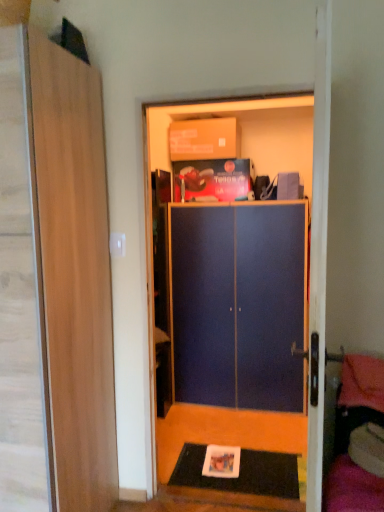
The width and height of the screenshot is (384, 512). I want to click on blue matte cabinet at center, so click(238, 305).

At what (x,y) coordinates should I click in order to perform the action: click on blue matte cabinet at center. Please return your answer as a coordinate pair (x, y). The height and width of the screenshot is (512, 384). Looking at the image, I should click on (240, 136).

At what (x,y) coordinates should I click in order to perform the action: click on wooden door at left. Please return your answer as a coordinate pair (x, y). Looking at the image, I should click on (75, 273).

Which of these two, wooden door at left or black rubber doormat at lower center, stands shorter?

Standing shorter between the two is black rubber doormat at lower center.

Would you say wooden door at left is outside black rubber doormat at lower center?

wooden door at left lies outside black rubber doormat at lower center's area.

Is wooden door at left positioned with its back to black rubber doormat at lower center?

No, wooden door at left's orientation is not away from black rubber doormat at lower center.

This screenshot has height=512, width=384. In order to click on door that appears above the black rubber doormat at lower center (from the image's perspective) in this screenshot , I will do `click(75, 273)`.

Based on their positions, is blue matte cabinet at center located to the left or right of matte cardboard box at upper center?

From the image, it's evident that blue matte cabinet at center is to the right of matte cardboard box at upper center.

Between blue matte cabinet at center and matte cardboard box at upper center, which one has larger width?

Wider between the two is blue matte cabinet at center.

Can you tell me how much blue matte cabinet at center and matte cardboard box at upper center differ in facing direction?

The angular difference between blue matte cabinet at center and matte cardboard box at upper center is 2.53 degrees.

How far apart are blue matte cabinet at center and matte cardboard box at upper center?

They are 34.79 inches apart.

Locate an element on the screen. dresser located on the right of wooden door at left is located at coordinates (240, 136).

Is wooden door at left in front of or behind blue matte cabinet at center in the image?

Visually, wooden door at left is located in front of blue matte cabinet at center.

Visually, is wooden door at left positioned to the left or to the right of blue matte cabinet at center?

Clearly, wooden door at left is on the left of blue matte cabinet at center in the image.

Is wooden door at left turned away from blue matte cabinet at center?

No, blue matte cabinet at center is not at the back of wooden door at left.

Considering the sizes of blue matte cabinet at center and blue matte cabinet at center in the image, is blue matte cabinet at center taller or shorter than blue matte cabinet at center?

blue matte cabinet at center is taller than blue matte cabinet at center.

Considering the sizes of objects blue matte cabinet at center and blue matte cabinet at center in the image provided, who is smaller, blue matte cabinet at center or blue matte cabinet at center?

blue matte cabinet at center is smaller.

Considering their positions, is blue matte cabinet at center located in front of or behind blue matte cabinet at center?

blue matte cabinet at center is positioned closer to the viewer than blue matte cabinet at center.

Is point (186, 224) behind point (286, 469)?

Yes, point (186, 224) is behind point (286, 469).

From a real-world perspective, is blue matte cabinet at center located beneath black rubber doormat at lower center?

No, from a real-world perspective, blue matte cabinet at center is not beneath black rubber doormat at lower center.

Who is more distant, blue matte cabinet at center or black rubber doormat at lower center?

blue matte cabinet at center is further away from the camera.

You are a GUI agent. You are given a task and a screenshot of the screen. Output one action in this format:
    pyautogui.click(x=<x>, y=<y>)
    Task: Click on the doormat on the left of blue matte cabinet at center
    
    Given the screenshot: What is the action you would take?
    pyautogui.click(x=241, y=473)

Does black rubber doormat at lower center have a lesser height compared to blue matte cabinet at center?

Indeed, black rubber doormat at lower center has a lesser height compared to blue matte cabinet at center.

What's the angular difference between black rubber doormat at lower center and blue matte cabinet at center's facing directions?

The angle between the facing direction of black rubber doormat at lower center and the facing direction of blue matte cabinet at center is 0.0694 degrees.

Considering the relative sizes of matte cardboard box at upper center and black rubber doormat at lower center in the image provided, is matte cardboard box at upper center bigger than black rubber doormat at lower center?

Yes, matte cardboard box at upper center is bigger than black rubber doormat at lower center.

Considering their positions, is matte cardboard box at upper center located in front of or behind black rubber doormat at lower center?

matte cardboard box at upper center is positioned farther from the viewer than black rubber doormat at lower center.

Consider the image. From a real-world perspective, is matte cardboard box at upper center below black rubber doormat at lower center?

No, from a real-world perspective, matte cardboard box at upper center is not beneath black rubber doormat at lower center.

You are a GUI agent. You are given a task and a screenshot of the screen. Output one action in this format:
    pyautogui.click(x=<x>, y=<y>)
    Task: Click on the door located above the black rubber doormat at lower center (from the image's perspective)
    
    Given the screenshot: What is the action you would take?
    pyautogui.click(x=75, y=273)

This screenshot has height=512, width=384. Find the location of `cardboard box to the left of blue matte cabinet at center`. cardboard box to the left of blue matte cabinet at center is located at coordinates (204, 139).

Based on the photo, from the image, which object appears to be farther from black rubber doormat at lower center, wooden door at left or matte cardboard box at upper center?

Based on the image, matte cardboard box at upper center appears to be further to black rubber doormat at lower center.

From the image, which object appears to be nearer to blue matte cabinet at center, blue matte cabinet at center or wooden door at left?

Based on the image, blue matte cabinet at center appears to be nearer to blue matte cabinet at center.

Which object lies nearer to the anchor point blue matte cabinet at center, black rubber doormat at lower center or wooden door at left?

The object closer to blue matte cabinet at center is black rubber doormat at lower center.

When comparing their distances from blue matte cabinet at center, does blue matte cabinet at center or black rubber doormat at lower center seem further?

The object further to blue matte cabinet at center is black rubber doormat at lower center.

Based on their spatial positions, is blue matte cabinet at center or blue matte cabinet at center closer to matte cardboard box at upper center?

Based on the image, blue matte cabinet at center appears to be nearer to matte cardboard box at upper center.

From the image, which object appears to be nearer to blue matte cabinet at center, blue matte cabinet at center or matte cardboard box at upper center?

The object closer to blue matte cabinet at center is matte cardboard box at upper center.

When comparing their distances from matte cardboard box at upper center, does wooden door at left or blue matte cabinet at center seem closer?

blue matte cabinet at center is closer to matte cardboard box at upper center.

Estimate the real-world distances between objects in this image. Which object is closer to matte cardboard box at upper center, blue matte cabinet at center or wooden door at left?

blue matte cabinet at center lies closer to matte cardboard box at upper center than the other object.

The width and height of the screenshot is (384, 512). Identify the location of cabinetry between blue matte cabinet at center and black rubber doormat at lower center in the vertical direction. (238, 305).

Where is `cabinetry between matte cardboard box at upper center and black rubber doormat at lower center vertically`? cabinetry between matte cardboard box at upper center and black rubber doormat at lower center vertically is located at coordinates (238, 305).

At what (x,y) coordinates should I click in order to perform the action: click on dresser located between wooden door at left and black rubber doormat at lower center in the left-right direction. Please return your answer as a coordinate pair (x, y). Image resolution: width=384 pixels, height=512 pixels. Looking at the image, I should click on click(x=240, y=136).

In order to click on door that lies between matte cardboard box at upper center and black rubber doormat at lower center from top to bottom in this screenshot , I will do `click(75, 273)`.